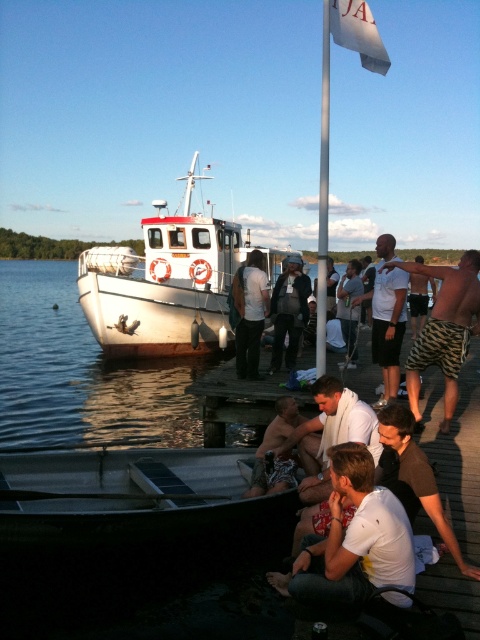
Question: Does white matte shirt at center have a smaller size compared to shiny metallic helmet at center?

Choices:
 (A) no
 (B) yes

Answer: (A)

Question: Is white matte shirt at lower center thinner than white towel at center?

Choices:
 (A) yes
 (B) no

Answer: (A)

Question: Is white matte shirt at center wider than dark gray fabric jacket at center?

Choices:
 (A) no
 (B) yes

Answer: (B)

Question: Among these objects, which one is farthest from the camera?

Choices:
 (A) white towel at center
 (B) white matte shirt at lower center
 (C) white cotton shirt at lower center

Answer: (A)

Question: Which object appears closest to the camera in this image?

Choices:
 (A) white matte shirt at center
 (B) white t-shirt at center
 (C) dark gray pants at center

Answer: (A)

Question: Which object appears farthest from the camera in this image?

Choices:
 (A) white matte shirt at center
 (B) white towel at center
 (C) white matte boat at center
 (D) white glossy water at boat left

Answer: (D)